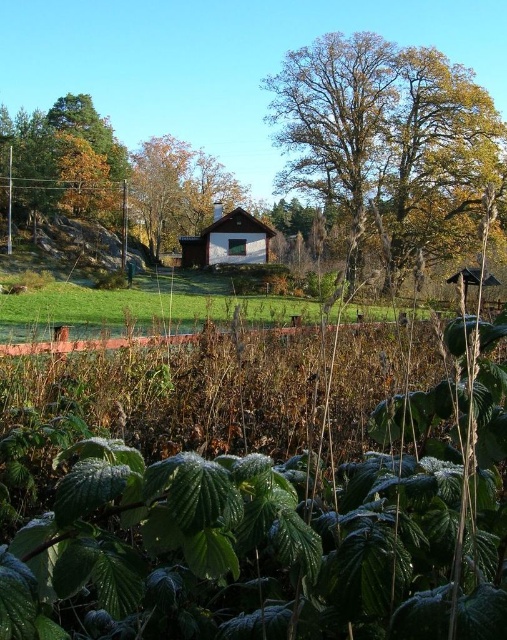
Is brown wood house at center positioned at the back of brown wooden hut at center?

No, it is not.

Between brown wood house at center and brown wooden hut at center, which one is positioned lower?

brown wooden hut at center is below.

Does point (79, 170) come in front of point (246, 220)?

No, (79, 170) is behind (246, 220).

Find the location of a particular element. brown wood house at center is located at coordinates 111,172.

From the picture: Is brown wood house at center shorter than green grass at center?

No, brown wood house at center is not shorter than green grass at center.

At what (x,y) coordinates should I click in order to perform the action: click on brown wood house at center. Please return your answer as a coordinate pair (x, y). Looking at the image, I should click on (111, 172).

Which is below, green grass at center or brown wooden hut at center?

Positioned lower is green grass at center.

Between point (90, 308) and point (190, 262), which one is positioned behind?

The point (190, 262) is behind.

Identify the location of green grass at center. (142, 307).